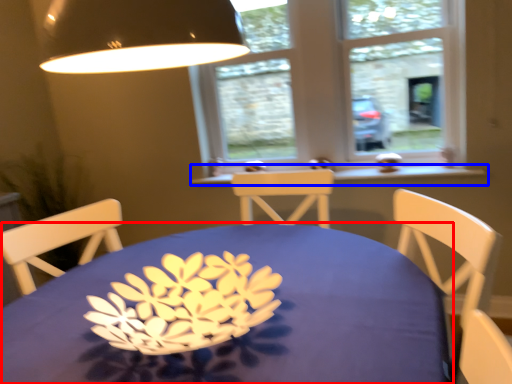
Question: Which of the following is the closest to the observer, table (highlighted by a red box) or window sill (highlighted by a blue box)?

Choices:
 (A) table
 (B) window sill

Answer: (A)